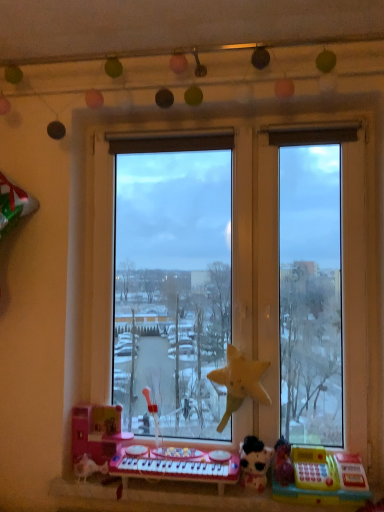
At what (x,y) coordinates should I click in order to perform the action: click on free region under yellow plastic cash register at lower right, placed as the first toy when sorted from right to left (from a real-world perspective). Please return your answer as a coordinate pair (x, y). This screenshot has width=384, height=512. Looking at the image, I should click on (327, 505).